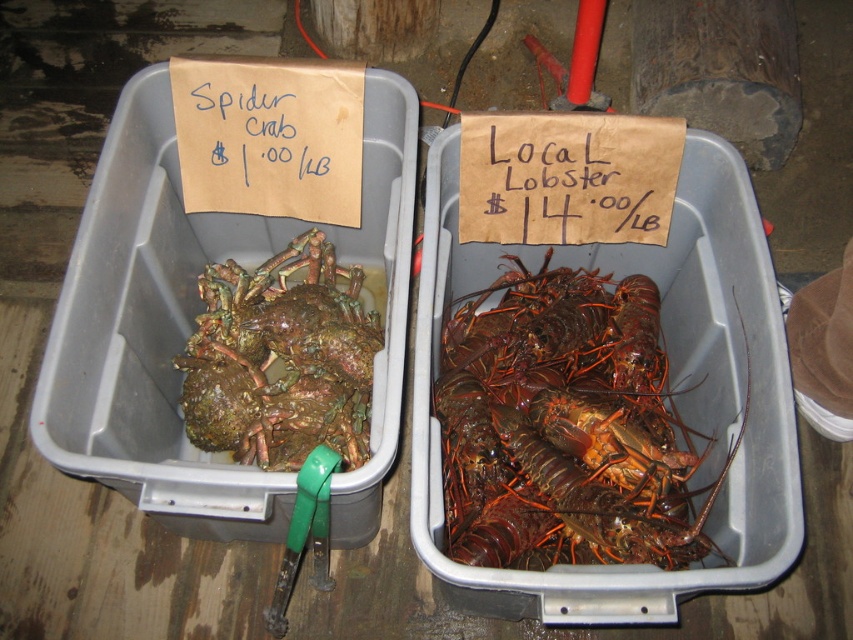
You are standing in front of the two containers of seafood. You want to pick up the container that is closer to you. Which container should you choose, the one at point (564, 524) or the one at point (368, 355)?

You should choose the container at point (564, 524) because it is closer to you than the container at point (368, 355).